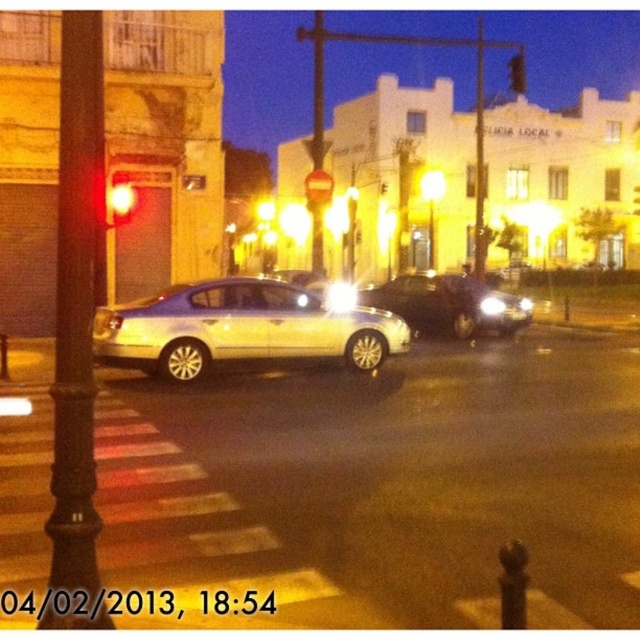
Question: Which point is farther from the camera taking this photo?

Choices:
 (A) (419, 289)
 (B) (122, 177)
 (C) (516, 51)
 (D) (228, 304)

Answer: (C)

Question: Is satin black sedan at center to the right of metallic traffic light at upper center from the viewer's perspective?

Choices:
 (A) no
 (B) yes

Answer: (A)

Question: Does satin black sedan at center have a smaller size compared to metallic traffic light at upper center?

Choices:
 (A) no
 (B) yes

Answer: (B)

Question: Is satin white sedan at center behind satin black sedan at center?

Choices:
 (A) yes
 (B) no

Answer: (B)

Question: Which point appears farthest from the camera in this image?

Choices:
 (A) (518, 90)
 (B) (134, 321)

Answer: (A)

Question: Considering the real-world distances, which object is farthest from the red glass traffic light at upper left?

Choices:
 (A) satin white sedan at center
 (B) satin black sedan at center

Answer: (B)